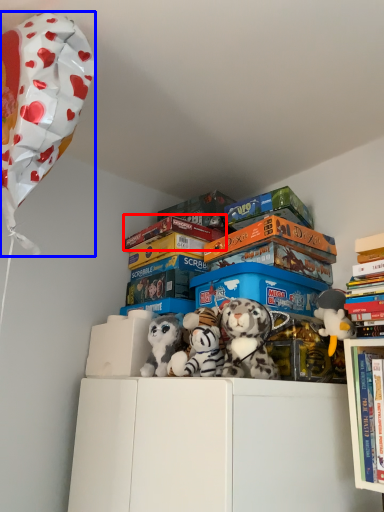
Question: Which point is closer to the camera, book (highlighted by a red box) or balloon (highlighted by a blue box)?

Choices:
 (A) book
 (B) balloon

Answer: (B)